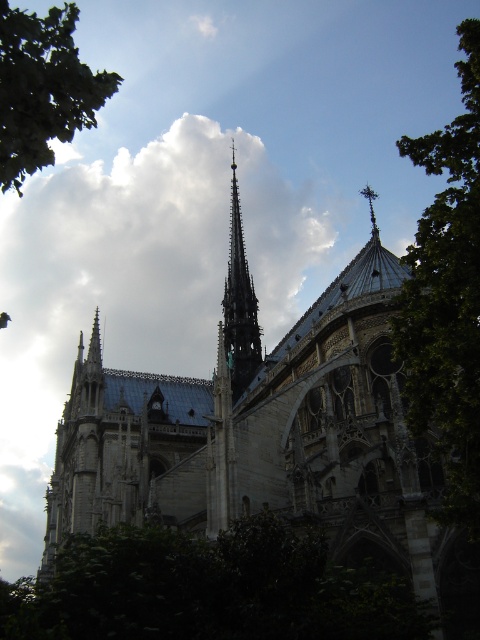
Question: Can you confirm if white fluffy cloud at upper center is positioned to the right of polished silver spire at upper right?

Choices:
 (A) no
 (B) yes

Answer: (A)

Question: Which of the following is the farthest from the observer?

Choices:
 (A) (232, 269)
 (B) (207, 282)

Answer: (B)

Question: Which point is closer to the camera?

Choices:
 (A) (430, 292)
 (B) (115, 74)
 (C) (368, 186)

Answer: (B)

Question: Which of the following is the closest to the observer?

Choices:
 (A) (330, 614)
 (B) (233, 387)
 (C) (365, 188)

Answer: (A)

Question: Does green leafy tree at right appear on the right side of polished silver spire at upper right?

Choices:
 (A) no
 (B) yes

Answer: (B)

Question: Can you confirm if white fluffy cloud at upper center is positioned below smooth gray spire at center?

Choices:
 (A) no
 (B) yes

Answer: (A)